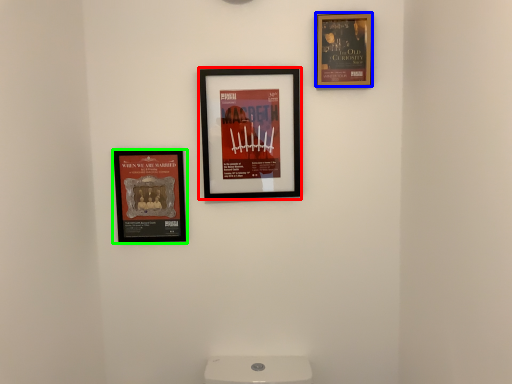
Question: Based on their relative distances, which object is nearer to picture frame (highlighted by a red box)? Choose from picture frame (highlighted by a blue box) and picture frame (highlighted by a green box).

Choices:
 (A) picture frame
 (B) picture frame

Answer: (B)